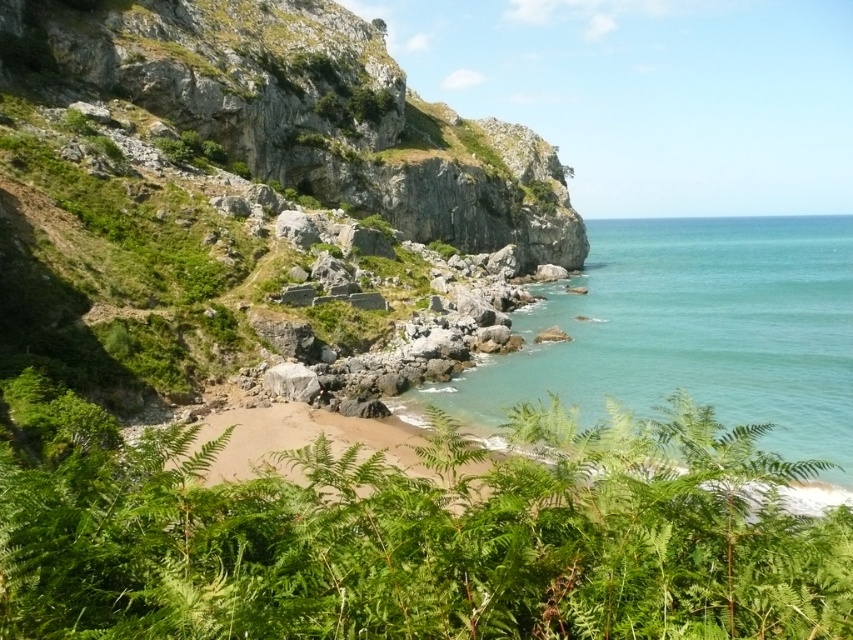
You are standing at the cliff edge and see two points marked on the cliff face. The first point is at coordinate point (444, 448) and the second is at point (776, 416). Which point is closer to you?

Point (444, 448) is in front of point (776, 416), so the first point is closer to you.

You are standing on the beach and see the green leafy ferns at lower center and the clear blue water at lower right. Which object is located to the right of the other?

The clear blue water at lower right is located to the right of the green leafy ferns at lower center because the green leafy ferns at lower center is positioned on the left side of clear blue water at lower right.